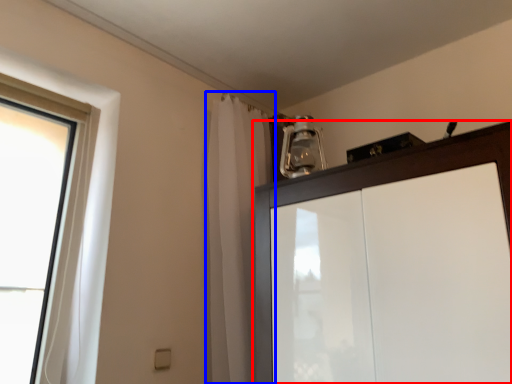
Question: Which object appears closest to the camera in this image, cupboard (highlighted by a red box) or shower curtain (highlighted by a blue box)?

Choices:
 (A) cupboard
 (B) shower curtain

Answer: (A)